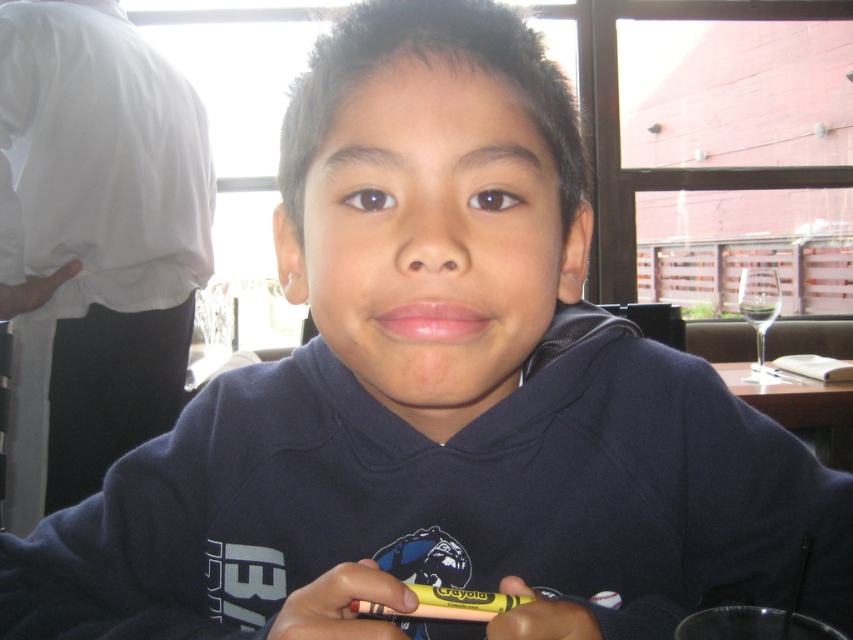
You are a parent trying to retrieve your child from the wooden table at center where they are sitting. As you approach, you notice the yellow plastic crayon at lower center. Is the crayon in front of or behind the table?

The yellow plastic crayon at lower center is behind the wooden table at center, so it is behind the table.

You are a child trying to reach for the crayons on the table. Which crayon, the yellow matte crayon at center or the yellow plastic crayon at lower center, is closer to you?

The yellow matte crayon at center is closer to you because it is in front of the yellow plastic crayon at lower center.

You are a teacher observing a student in a classroom. The student is holding the yellow matte crayon at center and sitting at the wooden table at center. Can you determine which object is taller between the two?

The yellow matte crayon at center has a lesser height compared to wooden table at center, so the wooden table at center is taller.